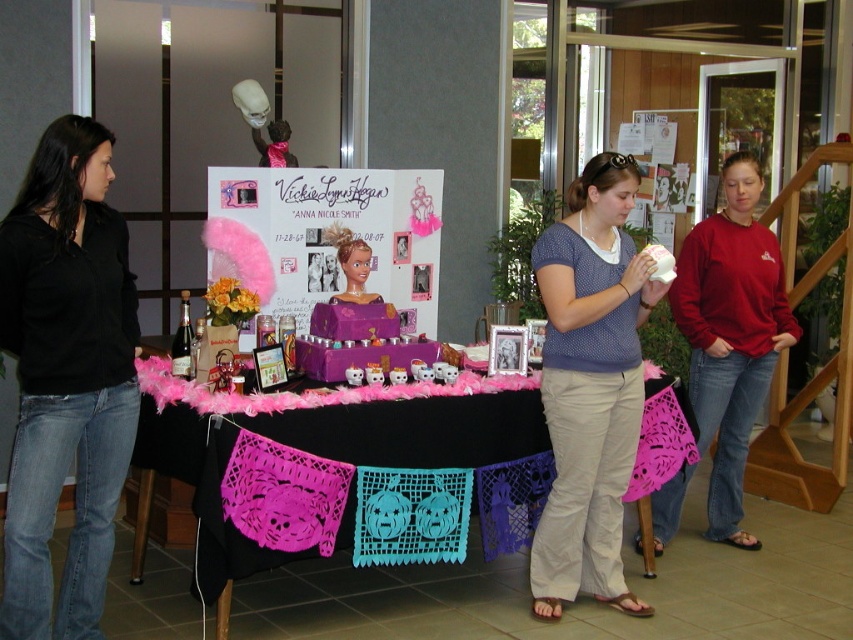
You are a party planner standing at the entrance of the room. You need to place a 4 feet long banner between the pink lace table at center and the pink feather boa at center. Will the banner fit between them?

The distance between the pink lace table at center and the pink feather boa at center is 3.89 feet. Since the banner is 4 feet long, it will not fit between them as the space is slightly shorter than the banner.

You are standing at the entrance of the room and want to locate the pink lace table at center. Based on the coordinates provided, in which direction should you walk to reach it?

The pink lace table at center is located at coordinates point (334, 460), so you should walk towards the center of the room to reach it.